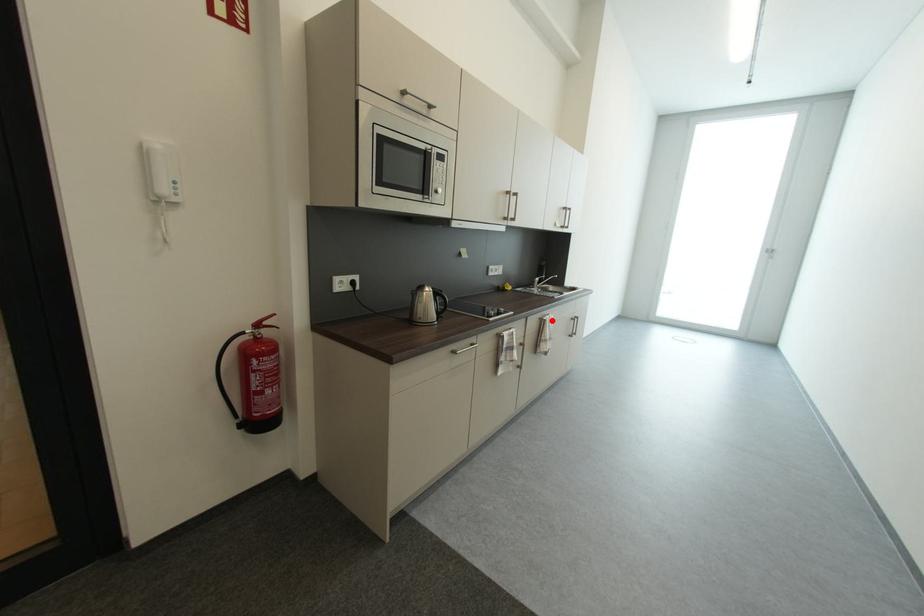
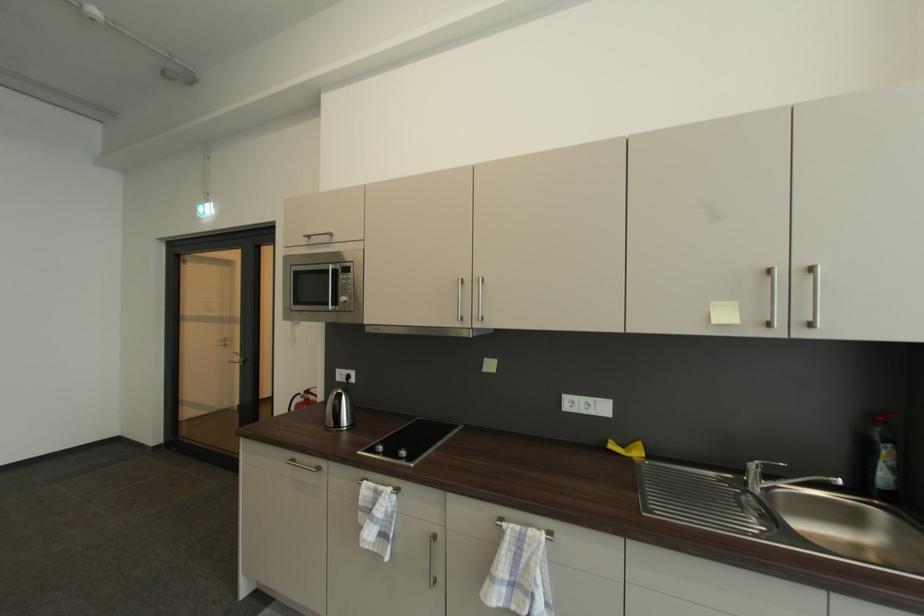
Find the pixel in the second image that matches the highlighted location in the first image.

(507, 529)